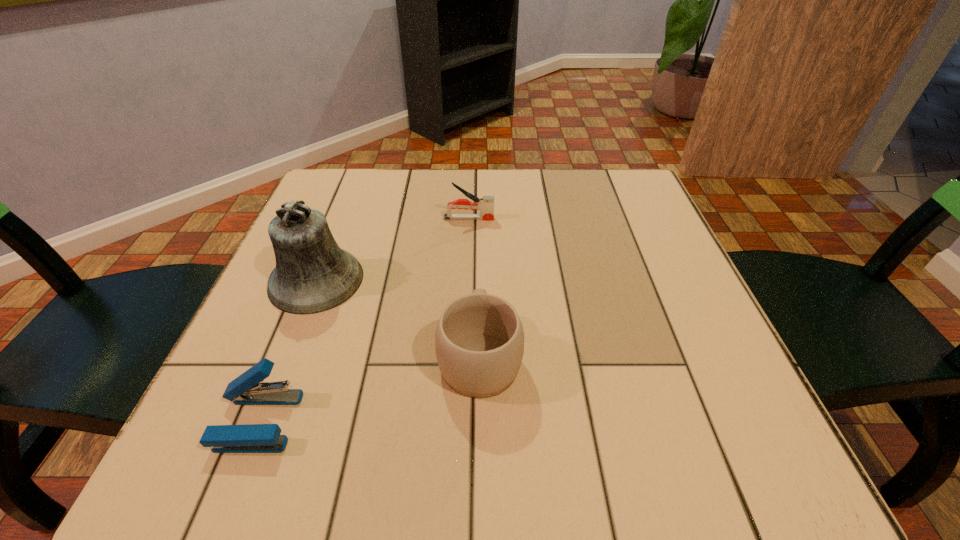
Where is `free space located on the handle side of the farther stapler`? The width and height of the screenshot is (960, 540). free space located on the handle side of the farther stapler is located at coordinates (621, 219).

At what (x,y) coordinates should I click in order to perform the action: click on free region located 0.140m on the back of the left stapler. Please return your answer as a coordinate pair (x, y). Image resolution: width=960 pixels, height=540 pixels. Looking at the image, I should click on (297, 324).

The image size is (960, 540). Identify the location of object located at the far edge. (486, 204).

You are a GUI agent. You are given a task and a screenshot of the screen. Output one action in this format:
    pyautogui.click(x=<x>, y=<y>)
    Task: Click on the object that is at the near edge
    The image size is (960, 540).
    Given the screenshot: What is the action you would take?
    pyautogui.click(x=246, y=389)

You are a GUI agent. You are given a task and a screenshot of the screen. Output one action in this format:
    pyautogui.click(x=<x>, y=<y>)
    Task: Click on the bell that is at the left edge
    Image resolution: width=960 pixels, height=540 pixels.
    Given the screenshot: What is the action you would take?
    pyautogui.click(x=313, y=274)

Image resolution: width=960 pixels, height=540 pixels. Find the location of `stapler that is at the left edge`. stapler that is at the left edge is located at coordinates (246, 389).

I want to click on object that is at the near left corner, so click(246, 389).

This screenshot has height=540, width=960. In the image, there is a desktop. Identify the location of vacant space at the far edge. (436, 174).

In the image, there is a desktop. Identify the location of vacant space at the near edge. (553, 473).

Where is `free space at the left edge of the desktop`? free space at the left edge of the desktop is located at coordinates (300, 315).